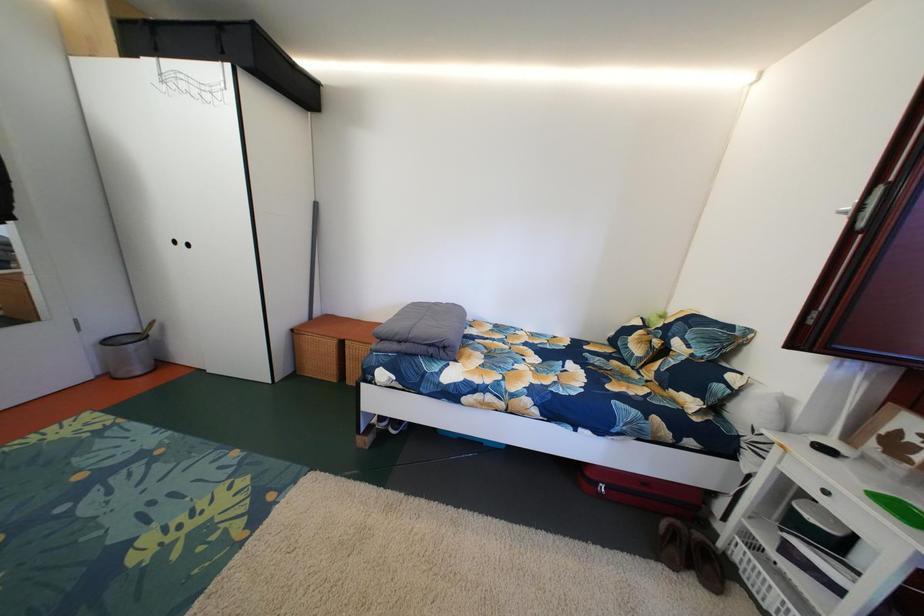
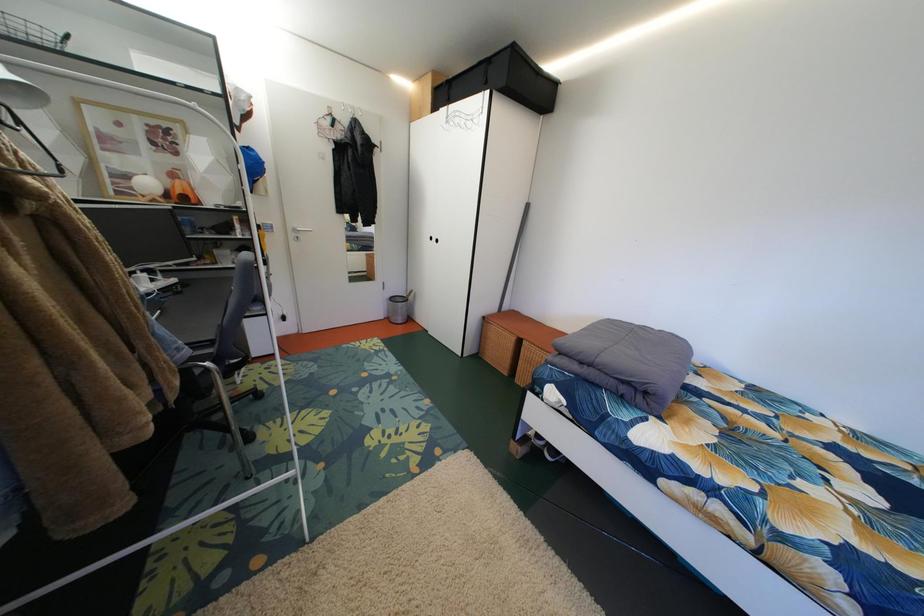
Question: Based on the continuous images, in which direction is the camera rotating? Reply with the corresponding letter.

Choices:
 (A) Left
 (B) Right
 (C) Up
 (D) Down

Answer: (A)